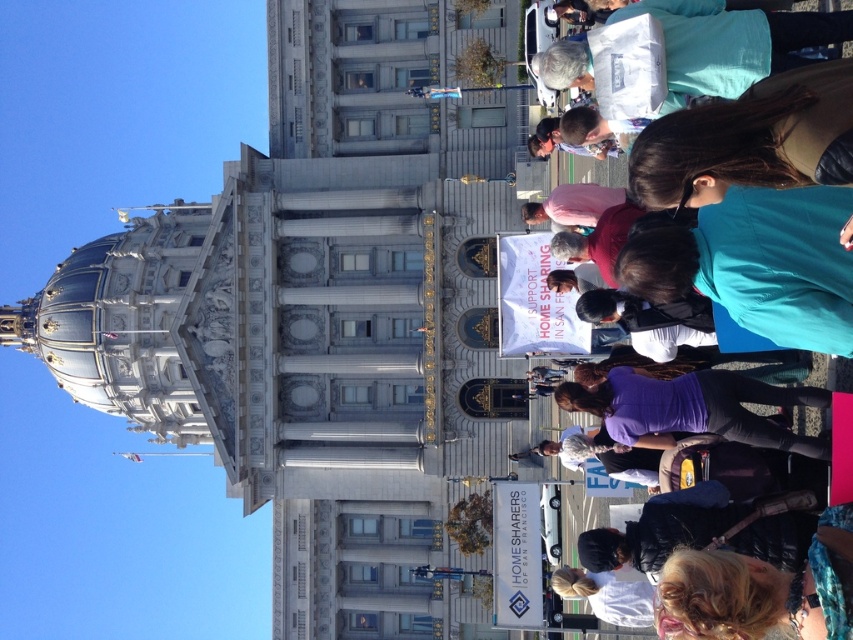
Is white marble tower at center below purple fabric at center?

No.

Which is above, white marble tower at center or purple fabric at center?

white marble tower at center is higher up.

Which is in front, point (86, 630) or point (683, 380)?

Positioned in front is point (683, 380).

Identify the location of white marble tower at center. (196, 509).

Who is more forward, (283, 317) or (814, 417)?

Positioned in front is point (814, 417).

Between white marble tower at center and teal fabric crowd at right, which one is positioned higher?

white marble tower at center is above.

Does point (401, 269) come closer to viewer compared to point (751, 0)?

No.

The image size is (853, 640). I want to click on white marble tower at center, so click(x=196, y=509).

In the scene shown: Is purple fabric at center to the left of blue fabric sign at upper center from the viewer's perspective?

No, purple fabric at center is not to the left of blue fabric sign at upper center.

Between point (668, 420) and point (444, 97), which one is positioned behind?

The point (444, 97) is behind.

You are a GUI agent. You are given a task and a screenshot of the screen. Output one action in this format:
    pyautogui.click(x=<x>, y=<y>)
    Task: Click on the purple fabric at center
    The height and width of the screenshot is (640, 853).
    Given the screenshot: What is the action you would take?
    tap(693, 408)